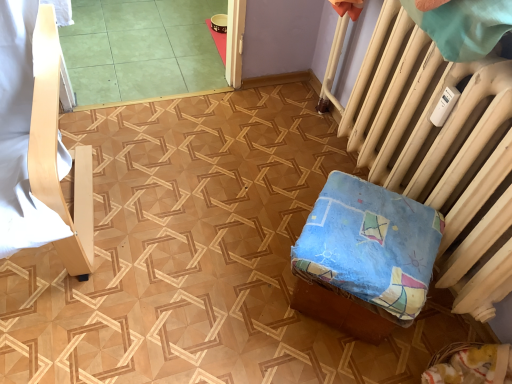
Question: From a real-world perspective, relative to white painted radiator at right, is blue fabric cushion at lower right, which appears as the first furniture when viewed from the right, vertically above or below?

Choices:
 (A) above
 (B) below

Answer: (B)

Question: Is blue fabric cushion at lower right, which appears as the first furniture when viewed from the right, taller or shorter than white painted radiator at right?

Choices:
 (A) tall
 (B) short

Answer: (B)

Question: Which object is positioned closest to the white painted radiator at right?

Choices:
 (A) light wood chair at left, the first furniture viewed from the left
 (B) green tile at upper left
 (C) blue fabric cushion at lower right, marked as the second furniture in a left-to-right arrangement

Answer: (C)

Question: Which is nearer to the white painted radiator at right?

Choices:
 (A) light wood chair at left, which is the second furniture from right to left
 (B) blue fabric cushion at lower right, marked as the second furniture in a left-to-right arrangement
 (C) green tile at upper left

Answer: (B)